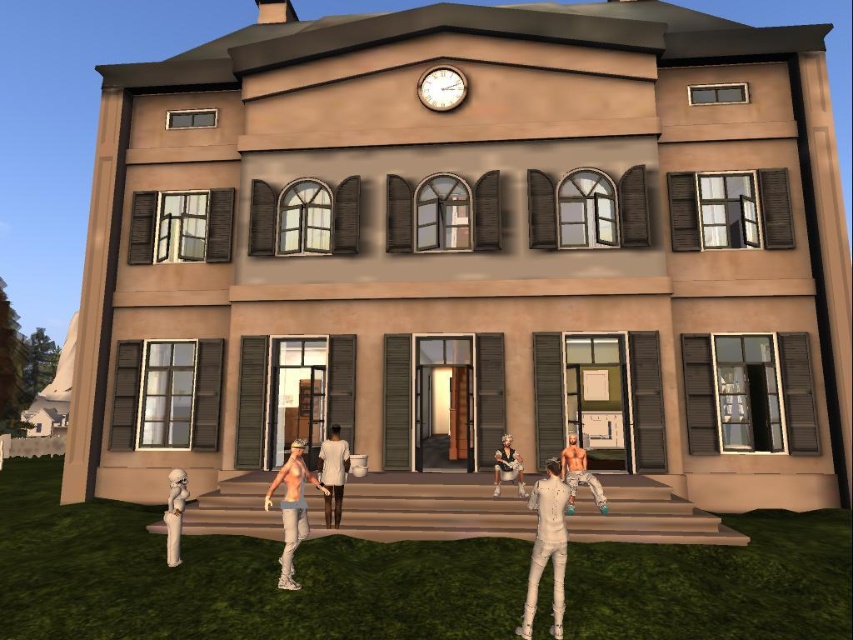
You are a visitor approaching the classical building and notice the wooden clock at upper center and the shiny metallic pants at center. Which object is located to the left of the other?

The wooden clock at upper center is positioned on the left side of shiny metallic pants at center, so the wooden clock at upper center is to the left of the shiny metallic pants at center.